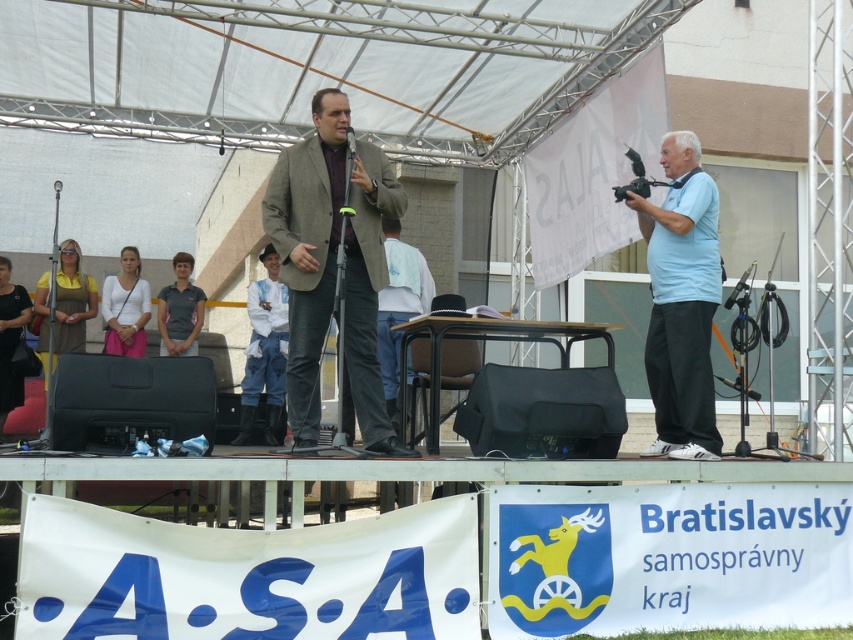
You are a photographer at the event and want to capture a clear photo of both the dark blue jersey at center and the metallic silver microphone at center. Which object should you focus on first to ensure both are in the frame?

The dark blue jersey at center is positioned under metallic silver microphone at center, so you should focus on the metallic silver microphone at center first to ensure both are in the frame.

You are a photographer at the event and want to capture both the matte brown suit at center and the white fabric shirt at center in a single photo. Which subject should you focus on first to ensure the taller one is in frame?

The matte brown suit at center is taller than the white fabric shirt at center, so focus on the matte brown suit at center first to ensure it fits in the frame.